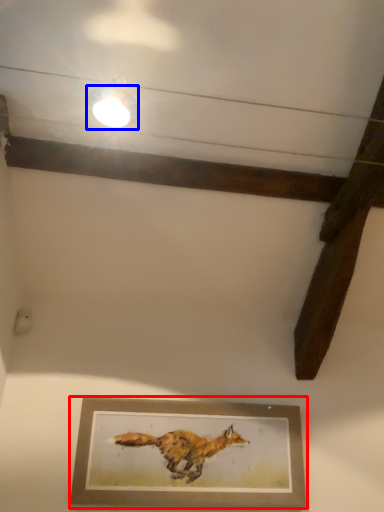
Question: Which of the following is the farthest to the observer, picture frame (highlighted by a red box) or light fixture (highlighted by a blue box)?

Choices:
 (A) picture frame
 (B) light fixture

Answer: (A)